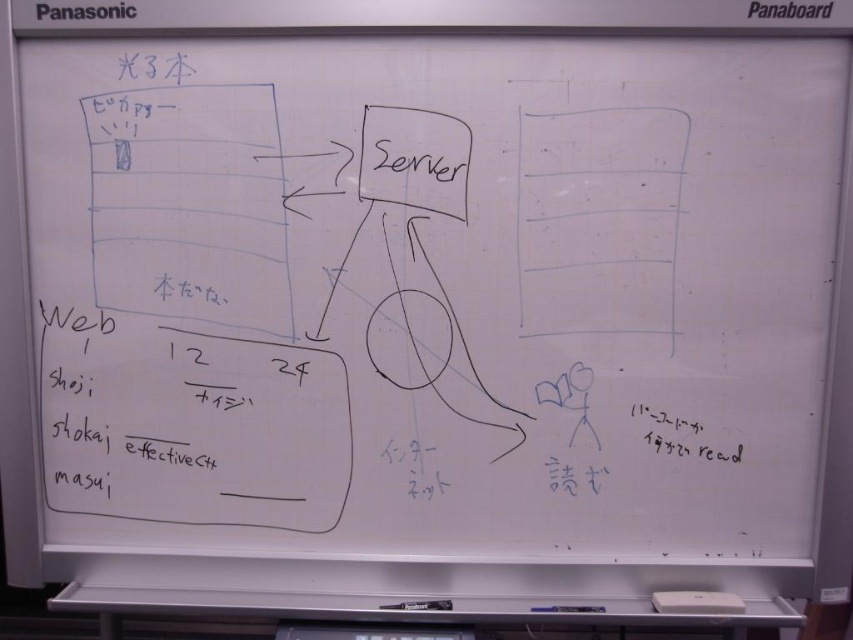
Question: Does black paper at lower right have a larger size compared to white matte eraser at bottom?

Choices:
 (A) no
 (B) yes

Answer: (A)

Question: Is black paper at lower right smaller than white matte eraser at bottom?

Choices:
 (A) no
 (B) yes

Answer: (B)

Question: Which point is closer to the camera?

Choices:
 (A) white matte eraser at bottom
 (B) black paper at lower right

Answer: (A)

Question: Which point is closer to the camera?

Choices:
 (A) black paper at lower right
 (B) white matte eraser at bottom

Answer: (B)

Question: Can you confirm if black paper at lower right is positioned to the right of white matte eraser at bottom?

Choices:
 (A) no
 (B) yes

Answer: (A)